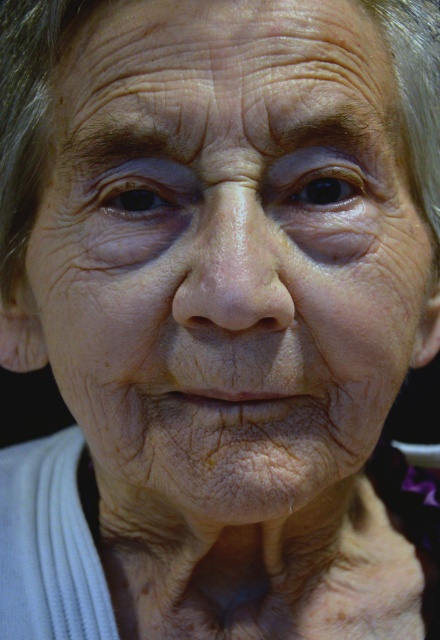
Question: Which point is closer to the camera?

Choices:
 (A) (344, 170)
 (B) (135, 170)

Answer: (B)

Question: Can you confirm if brown matte eye at upper center is positioned to the left of brown matte eye at upper left?

Choices:
 (A) yes
 (B) no

Answer: (B)

Question: Among these points, which one is nearest to the camera?

Choices:
 (A) (345, 189)
 (B) (132, 193)

Answer: (B)

Question: Among these objects, which one is farthest from the camera?

Choices:
 (A) brown matte eye at upper center
 (B) brown matte eye at upper left

Answer: (B)

Question: Does brown matte eye at upper center have a smaller size compared to brown matte eye at upper left?

Choices:
 (A) yes
 (B) no

Answer: (B)

Question: Can you confirm if brown matte eye at upper center is smaller than brown matte eye at upper left?

Choices:
 (A) no
 (B) yes

Answer: (A)